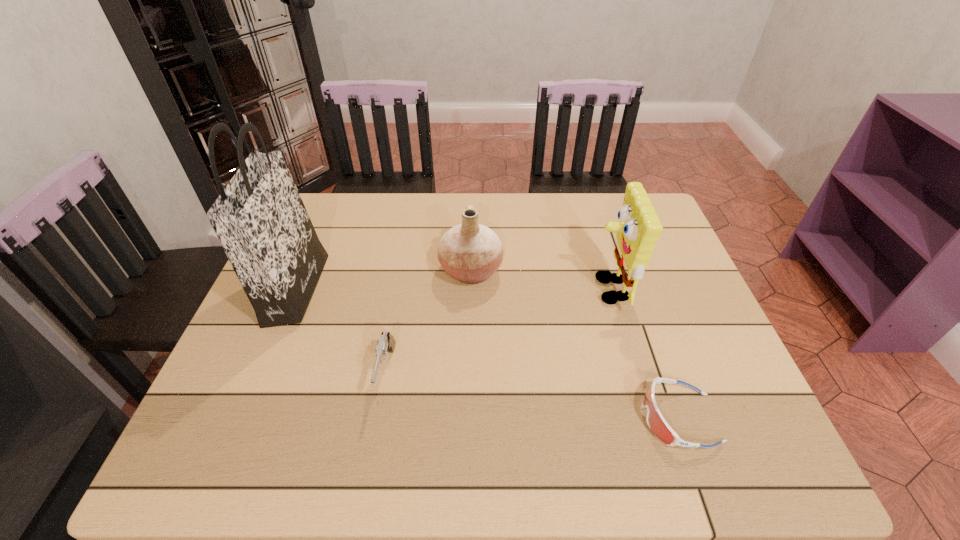
Find the location of `the leftmost object`. the leftmost object is located at coordinates (259, 218).

The height and width of the screenshot is (540, 960). What are the coordinates of `the tallest object` in the screenshot? It's located at (259, 218).

At what (x,y) coordinates should I click in order to perform the action: click on the fourth shortest object. Please return your answer as a coordinate pair (x, y). This screenshot has width=960, height=540. Looking at the image, I should click on (638, 230).

I want to click on the third shortest object, so click(x=471, y=253).

Find the location of a particular element. The width and height of the screenshot is (960, 540). pottery is located at coordinates (471, 253).

Find the location of a particular element. The image size is (960, 540). gun is located at coordinates (386, 343).

Where is `the fourth object from right to left`? the fourth object from right to left is located at coordinates (386, 343).

Find the location of `goggles`. goggles is located at coordinates (656, 422).

At what (x,y) coordinates should I click in order to perform the action: click on free space located 0.050m on the front of the shopping bag with the design. Please return your answer as a coordinate pair (x, y). This screenshot has width=960, height=540. Looking at the image, I should click on (335, 289).

Locate an element on the screen. This screenshot has width=960, height=540. vacant region located 0.110m on the face of the second tallest object is located at coordinates (548, 289).